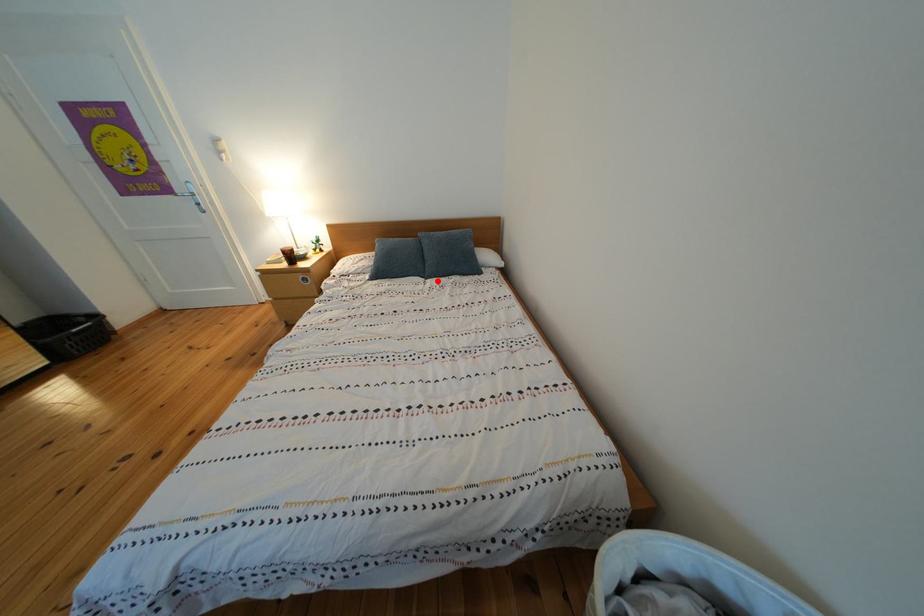
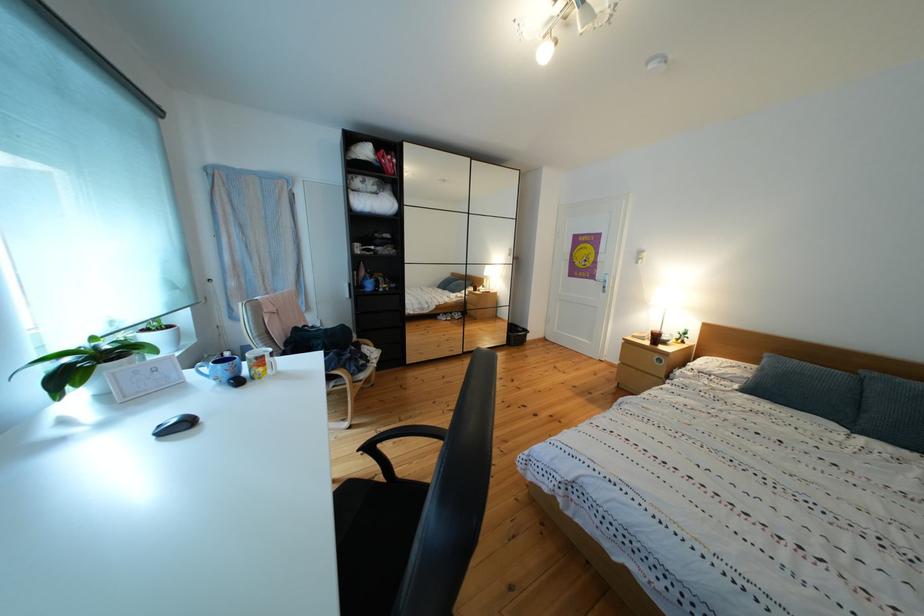
Find the pixel in the second image that matches the highlighted location in the first image.

(867, 434)